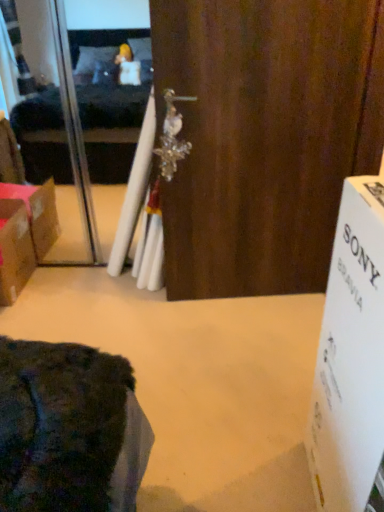
Question: Can you confirm if transparent plastic screen door at upper left is shorter than white cardboard box at right?

Choices:
 (A) no
 (B) yes

Answer: (A)

Question: Does transparent plastic screen door at upper left touch white cardboard box at right?

Choices:
 (A) yes
 (B) no

Answer: (B)

Question: Considering the relative sizes of transparent plastic screen door at upper left and white cardboard box at right in the image provided, is transparent plastic screen door at upper left taller than white cardboard box at right?

Choices:
 (A) no
 (B) yes

Answer: (B)

Question: Is transparent plastic screen door at upper left wider than white cardboard box at right?

Choices:
 (A) yes
 (B) no

Answer: (B)

Question: From a real-world perspective, is transparent plastic screen door at upper left over white cardboard box at right?

Choices:
 (A) yes
 (B) no

Answer: (A)

Question: From the image's perspective, is transparent plastic screen door at upper left beneath white cardboard box at right?

Choices:
 (A) no
 (B) yes

Answer: (A)

Question: Is the depth of brown cardboard box at left less than that of transparent plastic screen door at upper left?

Choices:
 (A) no
 (B) yes

Answer: (B)

Question: From a real-world perspective, does brown cardboard box at left stand above transparent plastic screen door at upper left?

Choices:
 (A) yes
 (B) no

Answer: (B)

Question: Can you confirm if brown cardboard box at left is bigger than transparent plastic screen door at upper left?

Choices:
 (A) no
 (B) yes

Answer: (A)

Question: Is brown cardboard box at left to the right of transparent plastic screen door at upper left from the viewer's perspective?

Choices:
 (A) no
 (B) yes

Answer: (A)

Question: From the image's perspective, is brown cardboard box at left on transparent plastic screen door at upper left?

Choices:
 (A) no
 (B) yes

Answer: (A)

Question: Is brown cardboard box at left completely or partially outside of transparent plastic screen door at upper left?

Choices:
 (A) no
 (B) yes

Answer: (B)

Question: Is brown cardboard box at left located within white cardboard box at right?

Choices:
 (A) no
 (B) yes

Answer: (A)